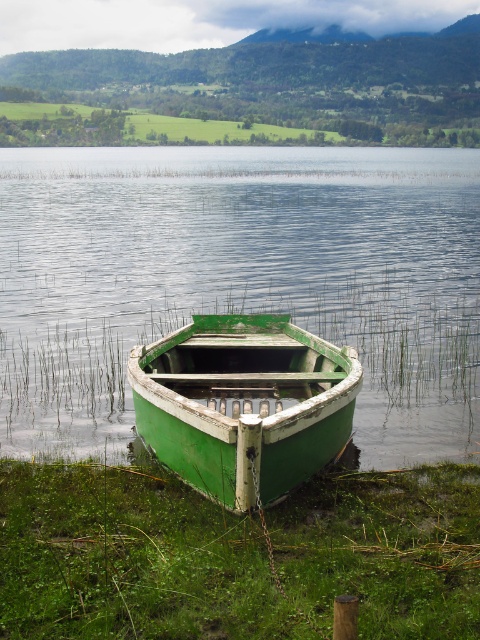
You are standing at the lakeside and want to walk to the point marked as point (49, 358). There is also a point marked as point (334, 385) in the background. Which point is closer to you?

Point (49, 358) is closer to you because it is further to the viewer than point (334, 385).

You are standing at the lakeside and want to walk towards the two points marked in the image. The first point is at coordinate point(131, 481) and the second point is at coordinate point(308, 346). Which point should you walk to first if you want to reach the closer one first?

Point point(131, 481) is closer to you than point(308, 346), so you should walk to point point(131, 481) first.

You are standing at the lakeside and want to take a photo of the green wood boat at center. If your camera has a maximum zoom range of 10 meters, will you be able to capture the boat clearly without moving closer?

The green wood boat at center is 8.35 meters away from the camera. Since the camera can zoom up to 10 meters, you can capture the boat clearly without moving closer.